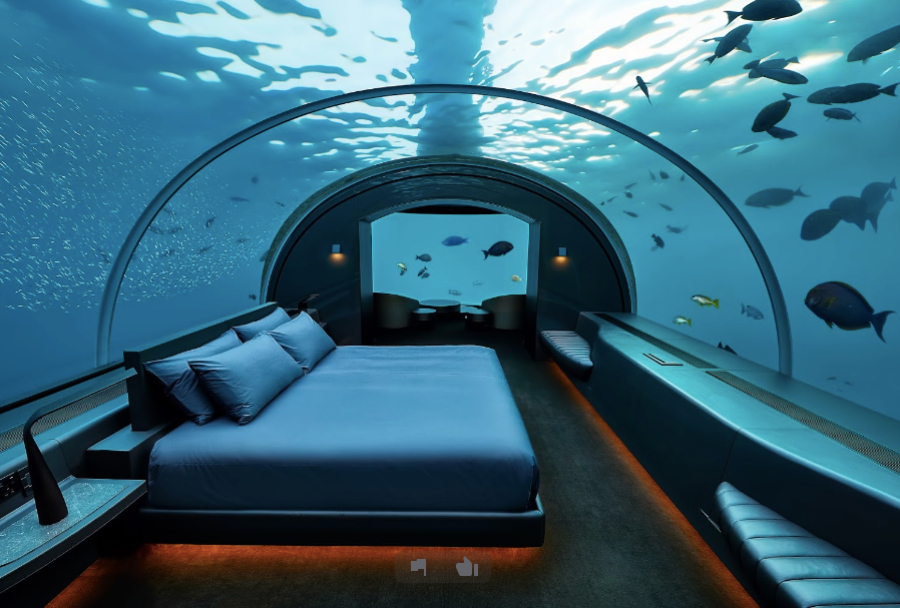
The width and height of the screenshot is (900, 608). Find the location of `light`. light is located at coordinates (562, 260), (338, 250).